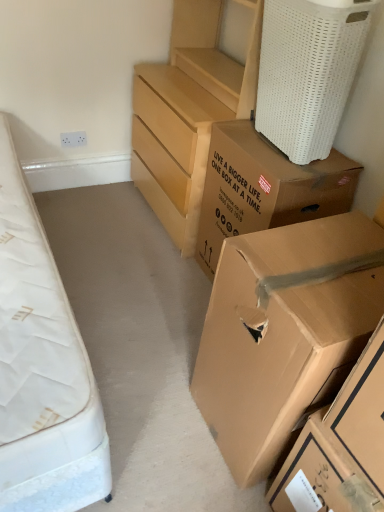
Question: Is brown cardboard box at upper right, the 3th box in the bottom-to-top sequence, not near brown cardboard box at lower right, the first box positioned from the bottom?

Choices:
 (A) no
 (B) yes

Answer: (A)

Question: From a real-world perspective, is brown cardboard box at upper right, positioned as the 1th box in top-to-bottom order, located beneath brown cardboard box at lower right, the third box from the top?

Choices:
 (A) no
 (B) yes

Answer: (A)

Question: Can we say brown cardboard box at upper right, positioned as the 1th box in top-to-bottom order, lies outside brown cardboard box at lower right, the first box positioned from the bottom?

Choices:
 (A) no
 (B) yes

Answer: (B)

Question: Does brown cardboard box at upper right, the 3th box in the bottom-to-top sequence, appear on the right side of brown cardboard box at lower right, the first box positioned from the bottom?

Choices:
 (A) yes
 (B) no

Answer: (B)

Question: From a real-world perspective, is brown cardboard box at upper right, positioned as the 1th box in top-to-bottom order, physically above brown cardboard box at lower right, the third box from the top?

Choices:
 (A) no
 (B) yes

Answer: (B)

Question: Considering the positions of white woven laundry basket at upper right and brown cardboard box at upper right, positioned as the 1th box in top-to-bottom order, in the image, is white woven laundry basket at upper right bigger or smaller than brown cardboard box at upper right, positioned as the 1th box in top-to-bottom order,?

Choices:
 (A) small
 (B) big

Answer: (A)

Question: From a real-world perspective, is white woven laundry basket at upper right positioned above or below brown cardboard box at upper right, the 3th box in the bottom-to-top sequence?

Choices:
 (A) below
 (B) above

Answer: (B)

Question: Considering their positions, is white woven laundry basket at upper right located in front of or behind brown cardboard box at upper right, positioned as the 1th box in top-to-bottom order?

Choices:
 (A) front
 (B) behind

Answer: (A)

Question: Which is correct: white woven laundry basket at upper right is inside brown cardboard box at upper right, the 3th box in the bottom-to-top sequence, or outside of it?

Choices:
 (A) outside
 (B) inside

Answer: (A)

Question: Is brown cardboard box at lower right, positioned as the 2th box in bottom-to-top order, wider or thinner than matte wood chest of drawers at center?

Choices:
 (A) wide
 (B) thin

Answer: (B)

Question: From a real-world perspective, is brown cardboard box at lower right, positioned as the 2th box in bottom-to-top order, positioned above or below matte wood chest of drawers at center?

Choices:
 (A) above
 (B) below

Answer: (B)

Question: Considering the positions of brown cardboard box at lower right, positioned as the 2th box in bottom-to-top order, and matte wood chest of drawers at center in the image, is brown cardboard box at lower right, positioned as the 2th box in bottom-to-top order, taller or shorter than matte wood chest of drawers at center?

Choices:
 (A) tall
 (B) short

Answer: (B)

Question: From the image's perspective, relative to matte wood chest of drawers at center, is brown cardboard box at lower right, the second box viewed from the top, above or below?

Choices:
 (A) below
 (B) above

Answer: (A)

Question: Visually, is white woven laundry basket at upper right positioned to the left or to the right of matte wood chest of drawers at center?

Choices:
 (A) left
 (B) right

Answer: (B)

Question: Relative to matte wood chest of drawers at center, is white woven laundry basket at upper right in front or behind?

Choices:
 (A) front
 (B) behind

Answer: (A)